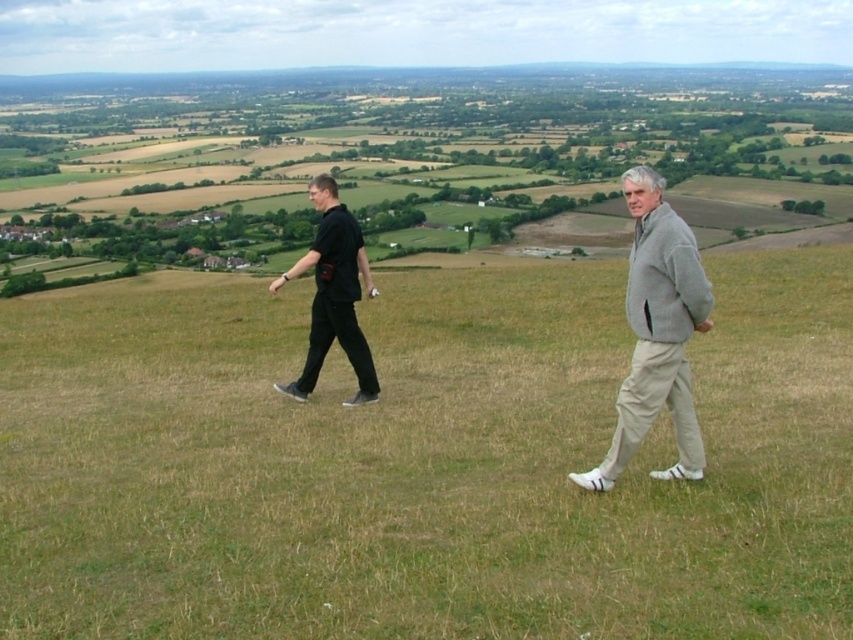
Question: Which point is farther from the camera taking this photo?

Choices:
 (A) (28, 467)
 (B) (370, 292)
 (C) (691, 292)
 (D) (654, 216)

Answer: (B)

Question: Considering the real-world distances, which object is farthest from the green grassy field at center?

Choices:
 (A) black cotton shirt at left
 (B) black matte pants at left
 (C) gray fleece jacket at center

Answer: (B)

Question: Can you confirm if gray fleece jacket at center is positioned to the right of black matte pants at left?

Choices:
 (A) no
 (B) yes

Answer: (B)

Question: Can you confirm if gray fleece jacket at center is positioned to the left of black matte pants at left?

Choices:
 (A) no
 (B) yes

Answer: (A)

Question: Which point is closer to the camera?

Choices:
 (A) (456, 428)
 (B) (646, 198)
 (C) (646, 362)
 (D) (311, 186)

Answer: (B)

Question: Does black cotton shirt at left appear over black matte pants at left?

Choices:
 (A) yes
 (B) no

Answer: (B)